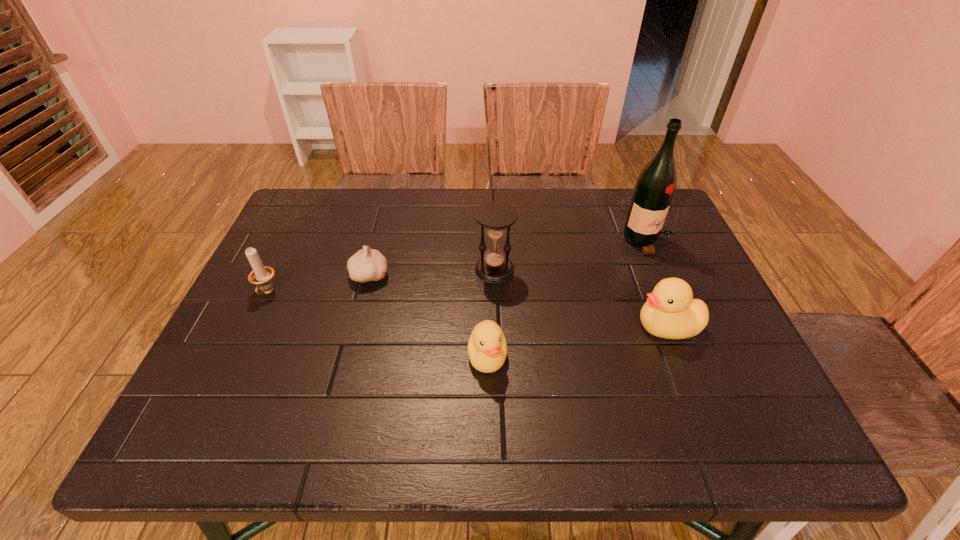
The height and width of the screenshot is (540, 960). I want to click on the fifth tallest object, so click(487, 349).

I want to click on the shorter duck, so click(487, 349).

Locate an element on the screen. The height and width of the screenshot is (540, 960). the taller duck is located at coordinates (670, 312).

In order to click on wine bottle in this screenshot , I will do `click(656, 184)`.

The height and width of the screenshot is (540, 960). In order to click on the shortest object in this screenshot , I will do `click(367, 264)`.

Identify the location of the second object from left to right. This screenshot has height=540, width=960. (367, 264).

Where is `candle_holder`? Image resolution: width=960 pixels, height=540 pixels. candle_holder is located at coordinates [262, 276].

Locate an element on the screen. hourglass is located at coordinates (495, 217).

At what (x,y) coordinates should I click in order to perform the action: click on vacant space located at the beak of the taller duck. Please return your answer as a coordinate pair (x, y). Looking at the image, I should click on (599, 326).

The width and height of the screenshot is (960, 540). I want to click on blank space located at the beak of the taller duck, so 572,326.